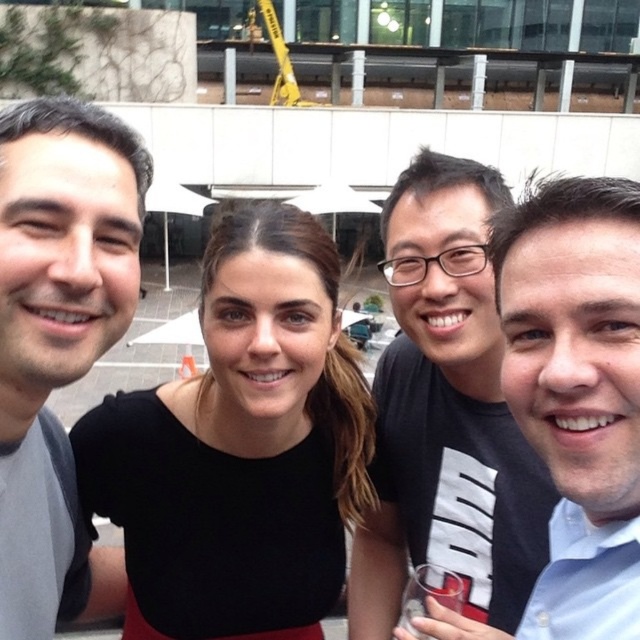
Between point (474, 244) and point (548, 451), which one is positioned in front?

Positioned in front is point (548, 451).

How much distance is there between black matte shirt at upper right and blue shirt at right?

A distance of 25.54 inches exists between black matte shirt at upper right and blue shirt at right.

Describe the element at coordinates (445, 413) in the screenshot. I see `black matte shirt at upper right` at that location.

This screenshot has height=640, width=640. I want to click on black matte shirt at upper right, so click(x=445, y=413).

Does black matte dress at center appear on the right side of matte gray shirt at left?

Correct, you'll find black matte dress at center to the right of matte gray shirt at left.

Is black matte dress at center wider than matte gray shirt at left?

Correct, the width of black matte dress at center exceeds that of matte gray shirt at left.

Does point (230, 579) lie behind point (131, 236)?

That is True.

I want to click on black matte dress at center, so click(x=241, y=448).

Can you confirm if matte gray shirt at left is positioned to the left of blue shirt at right?

Yes, matte gray shirt at left is to the left of blue shirt at right.

Does matte gray shirt at left have a larger size compared to blue shirt at right?

Correct, matte gray shirt at left is larger in size than blue shirt at right.

The height and width of the screenshot is (640, 640). What do you see at coordinates (58, 342) in the screenshot?
I see `matte gray shirt at left` at bounding box center [58, 342].

The width and height of the screenshot is (640, 640). What are the coordinates of `matte gray shirt at left` in the screenshot? It's located at (58, 342).